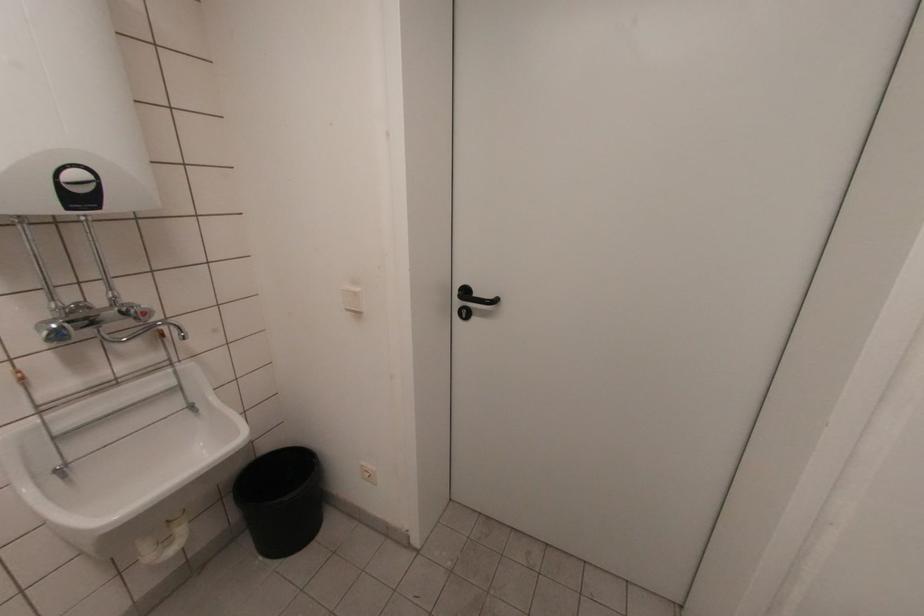
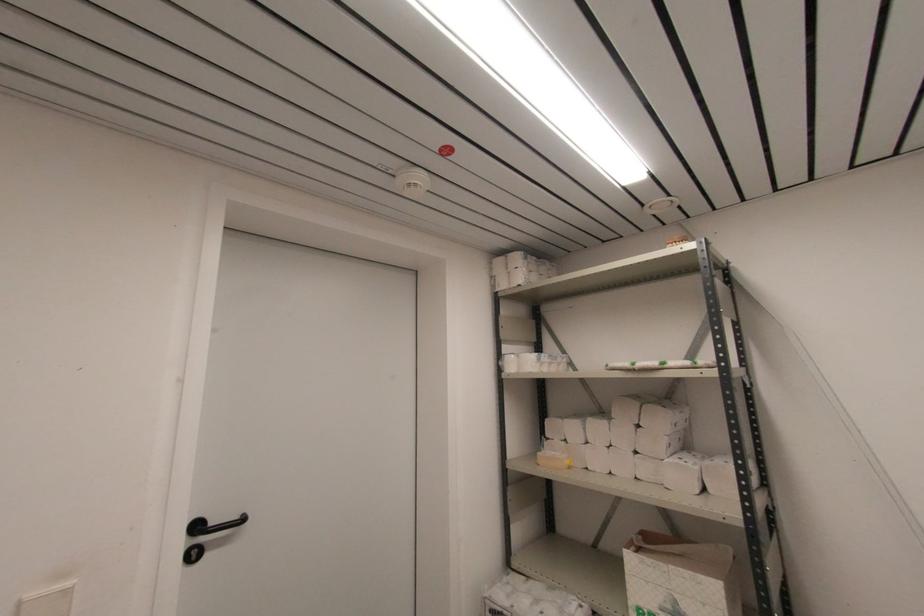
The first image is from the beginning of the video and the second image is from the end. How did the camera likely rotate when shooting the video?

The rotation direction of the camera is right-up.